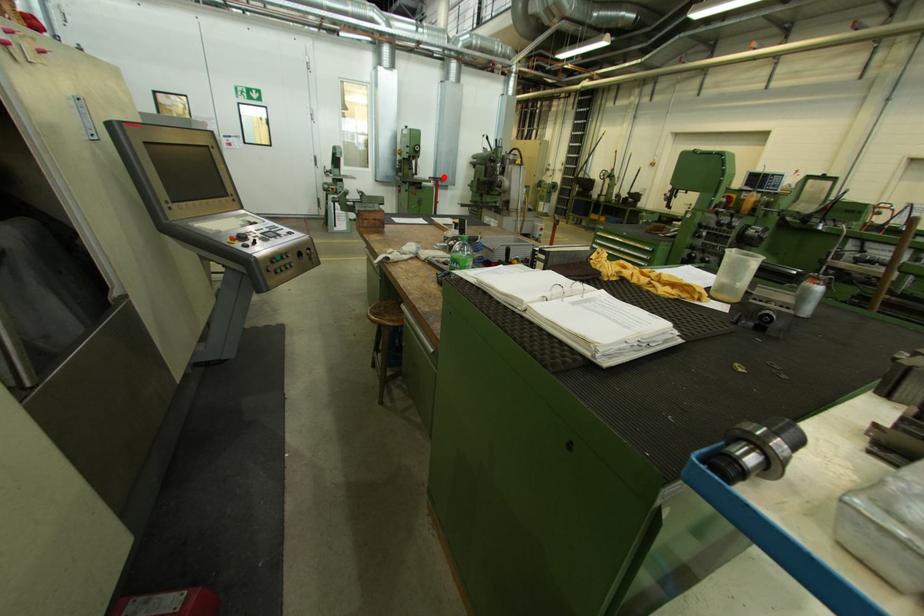
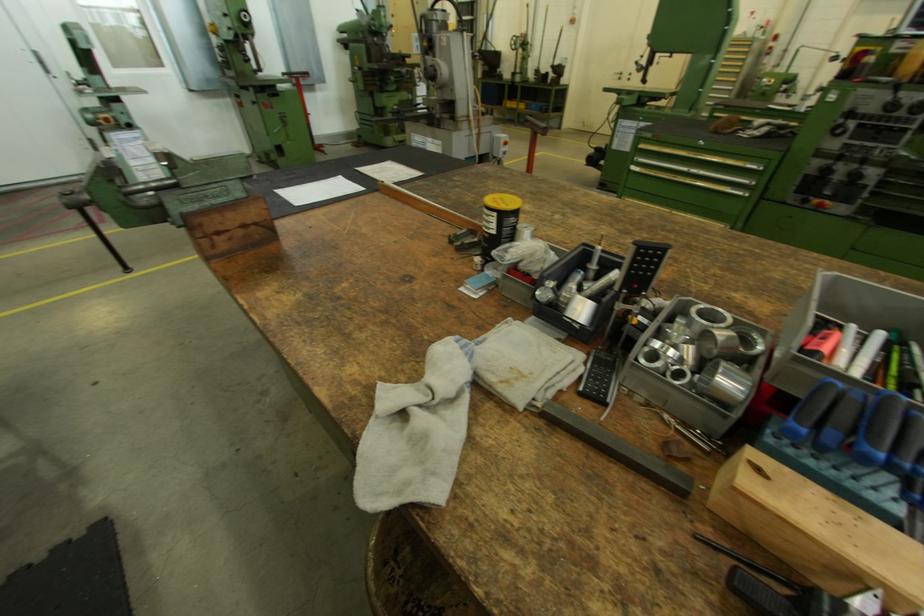
In the second image, find the point that corresponds to the highlighted location in the first image.

(299, 71)